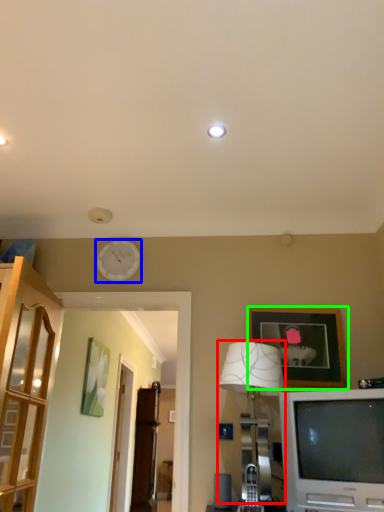
Question: Based on their relative distances, which object is nearer to lamp (highlighted by a red box)? Choose from clock (highlighted by a blue box) and picture frame (highlighted by a green box).

Choices:
 (A) clock
 (B) picture frame

Answer: (B)